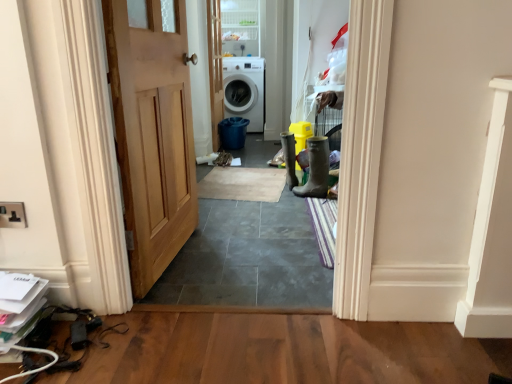
Where is `white glossy door at center, placed as the 1th door when sorted from back to front`? Image resolution: width=512 pixels, height=384 pixels. white glossy door at center, placed as the 1th door when sorted from back to front is located at coordinates (215, 68).

In order to face clear glass door at upper center, should I rotate leftwards or rightwards?

Turn left by 2.172 degrees to look at clear glass door at upper center.

This screenshot has width=512, height=384. I want to click on white glossy washing machine at center, so pyautogui.click(x=245, y=90).

What are the coordinates of `white glossy door at center, the second door positioned from the front` in the screenshot? It's located at (215, 68).

Is natural wood door at center, acting as the first door starting from the front, turned away from white glossy washing machine at center?

That's not correct — natural wood door at center, acting as the first door starting from the front, is not looking away from white glossy washing machine at center.

Would you say natural wood door at center, acting as the first door starting from the front, contains white glossy washing machine at center?

No.

Based on the photo, considering their positions, is natural wood door at center, acting as the first door starting from the front, located in front of or behind white glossy washing machine at center?

natural wood door at center, acting as the first door starting from the front, is positioned closer to the viewer than white glossy washing machine at center.

Looking at the image, does natural wood door at center, positioned as the second door in back-to-front order, seem bigger or smaller compared to white glossy washing machine at center?

Clearly, natural wood door at center, positioned as the second door in back-to-front order, is smaller in size than white glossy washing machine at center.

Is white glossy washing machine at center at the back of white glossy door at center, placed as the 1th door when sorted from back to front?

No, white glossy door at center, placed as the 1th door when sorted from back to front, is not facing the opposite direction of white glossy washing machine at center.

Between white glossy door at center, the second door positioned from the front, and white glossy washing machine at center, which one appears on the left side from the viewer's perspective?

Positioned to the left is white glossy door at center, the second door positioned from the front.

Can you tell me how much white glossy door at center, the second door positioned from the front, and white glossy washing machine at center differ in facing direction?

They differ by 89 degrees in their facing directions.

Is point (214, 93) more distant than point (238, 83)?

No, (214, 93) is in front of (238, 83).

Considering the sizes of objects clear glass door at upper center and natural wood door at center, positioned as the second door in back-to-front order, in the image provided, who is taller, clear glass door at upper center or natural wood door at center, positioned as the second door in back-to-front order,?

With more height is natural wood door at center, positioned as the second door in back-to-front order.

Locate an element on the screen. The image size is (512, 384). the 2nd door below the clear glass door at upper center (from the image's perspective) is located at coordinates (152, 136).

From the image's perspective, is clear glass door at upper center on natural wood door at center, acting as the first door starting from the front?

Correct, clear glass door at upper center appears higher than natural wood door at center, acting as the first door starting from the front, in the image.

Is the surface of clear glass door at upper center in direct contact with natural wood door at center, positioned as the second door in back-to-front order?

No.

From the picture: Is clear glass door at upper center next to white glossy washing machine at center and touching it?

No, clear glass door at upper center is not beside white glossy washing machine at center.

Between clear glass door at upper center and white glossy washing machine at center, which one is positioned behind?

white glossy washing machine at center is more distant.

From the image's perspective, is clear glass door at upper center under white glossy washing machine at center?

No, from the image's perspective, clear glass door at upper center is not beneath white glossy washing machine at center.

Considering the sizes of objects white glossy washing machine at center and natural wood door at center, positioned as the second door in back-to-front order, in the image provided, who is bigger, white glossy washing machine at center or natural wood door at center, positioned as the second door in back-to-front order,?

white glossy washing machine at center is bigger.

Which object is further away from the camera taking this photo, white glossy washing machine at center or natural wood door at center, acting as the first door starting from the front?

Positioned behind is white glossy washing machine at center.

Can natural wood door at center, positioned as the second door in back-to-front order, be found inside white glossy washing machine at center?

No.

Can you confirm if white glossy washing machine at center is thinner than natural wood door at center, positioned as the second door in back-to-front order?

No.

Is clear glass door at upper center further to camera compared to white glossy door at center, placed as the 1th door when sorted from back to front?

Yes, it is.

Image resolution: width=512 pixels, height=384 pixels. I want to click on the 1st door in front of the clear glass door at upper center, so click(x=215, y=68).

Does clear glass door at upper center have a lesser width compared to white glossy door at center, placed as the 1th door when sorted from back to front?

In fact, clear glass door at upper center might be wider than white glossy door at center, placed as the 1th door when sorted from back to front.

From the image's perspective, which object appears higher, clear glass door at upper center or white glossy door at center, placed as the 1th door when sorted from back to front?

clear glass door at upper center appears higher in the image.

Considering the positions of point (224, 99) and point (258, 17), is point (224, 99) closer or farther from the camera than point (258, 17)?

Point (224, 99).

Does white glossy washing machine at center have a larger size compared to clear glass door at upper center?

Correct, white glossy washing machine at center is larger in size than clear glass door at upper center.

Can you confirm if white glossy washing machine at center is thinner than clear glass door at upper center?

No.

Which object is closer to the camera taking this photo, white glossy washing machine at center or clear glass door at upper center?

clear glass door at upper center is more forward.

You are a GUI agent. You are given a task and a screenshot of the screen. Output one action in this format:
    pyautogui.click(x=<x>, y=<y>)
    Task: Click on the 1st door above the white glossy washing machine at center (from a real-world perspective)
    
    Given the screenshot: What is the action you would take?
    pyautogui.click(x=152, y=136)

At what (x,y) coordinates should I click in order to perform the action: click on washing machine above the white glossy door at center, the second door positioned from the front (from the image's perspective). Please return your answer as a coordinate pair (x, y). Looking at the image, I should click on (245, 90).

Based on their spatial positions, is white glossy washing machine at center or white glossy door at center, placed as the 1th door when sorted from back to front, closer to clear glass door at upper center?

Among the two, white glossy washing machine at center is located nearer to clear glass door at upper center.

From the image, which object appears to be farther from white glossy door at center, placed as the 1th door when sorted from back to front, white glossy washing machine at center or natural wood door at center, acting as the first door starting from the front?

Among the two, natural wood door at center, acting as the first door starting from the front, is located further to white glossy door at center, placed as the 1th door when sorted from back to front.

Consider the image. Considering their positions, is clear glass door at upper center positioned closer to white glossy door at center, the second door positioned from the front, than white glossy washing machine at center?

white glossy washing machine at center is positioned closer to the anchor white glossy door at center, the second door positioned from the front.

Which object lies nearer to the anchor point white glossy washing machine at center, natural wood door at center, acting as the first door starting from the front, or white glossy door at center, the second door positioned from the front?

white glossy door at center, the second door positioned from the front.

Estimate the real-world distances between objects in this image. Which object is closer to white glossy washing machine at center, white glossy door at center, the second door positioned from the front, or clear glass door at upper center?

Among the two, clear glass door at upper center is located nearer to white glossy washing machine at center.

Considering their positions, is clear glass door at upper center positioned closer to natural wood door at center, positioned as the second door in back-to-front order, than white glossy washing machine at center?

white glossy washing machine at center lies closer to natural wood door at center, positioned as the second door in back-to-front order, than the other object.

Based on their spatial positions, is natural wood door at center, positioned as the second door in back-to-front order, or white glossy washing machine at center further from clear glass door at upper center?

natural wood door at center, positioned as the second door in back-to-front order, lies further to clear glass door at upper center than the other object.

Considering their positions, is natural wood door at center, positioned as the second door in back-to-front order, positioned closer to clear glass door at upper center than white glossy door at center, the second door positioned from the front?

white glossy door at center, the second door positioned from the front.

Locate an element on the screen. This screenshot has height=384, width=512. door positioned between natural wood door at center, positioned as the second door in back-to-front order, and clear glass door at upper center from near to far is located at coordinates (215, 68).

This screenshot has width=512, height=384. I want to click on glass door between natural wood door at center, positioned as the second door in back-to-front order, and white glossy washing machine at center, along the z-axis, so click(240, 27).

At what (x,y) coordinates should I click in order to perform the action: click on door between natural wood door at center, positioned as the second door in back-to-front order, and white glossy washing machine at center in the front-back direction. Please return your answer as a coordinate pair (x, y). Looking at the image, I should click on (215, 68).

This screenshot has width=512, height=384. In order to click on glass door located between white glossy door at center, placed as the 1th door when sorted from back to front, and white glossy washing machine at center in the depth direction in this screenshot , I will do `click(240, 27)`.